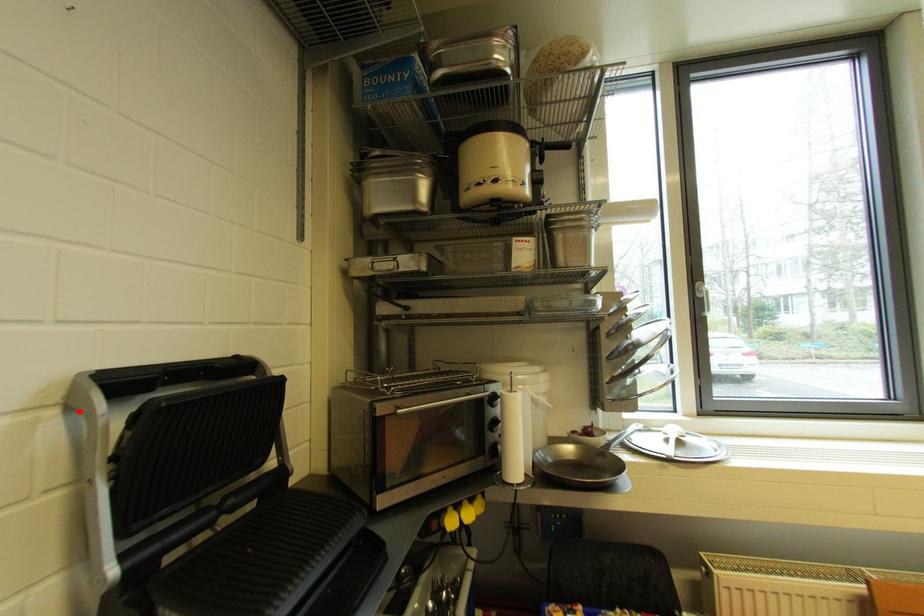
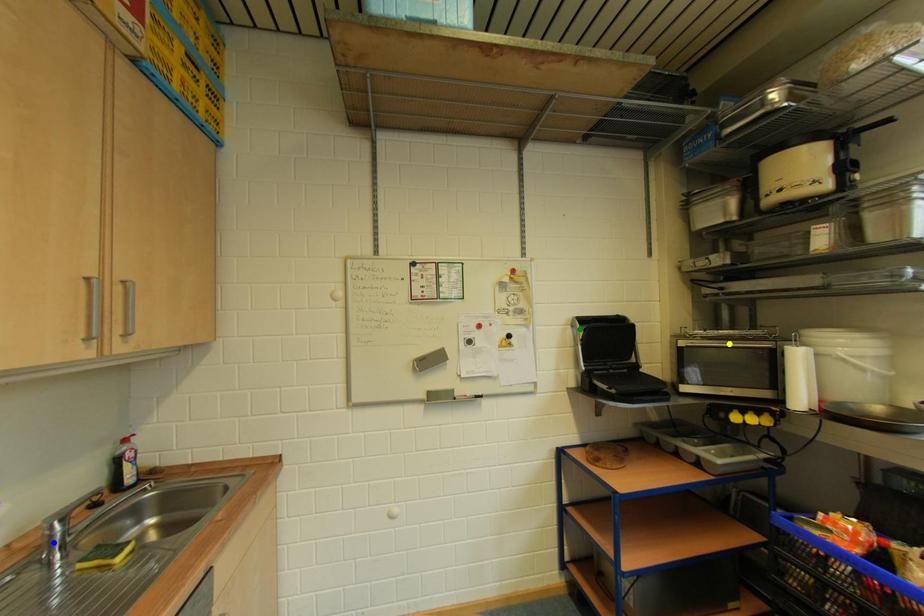
Question: I am providing you with two images of the same scene from different viewpoints. A red point is marked on the first image. You are given multiple points on the second image. Which spot in image 2 lines up with the point in image 1?

Choices:
 (A) green point
 (B) yellow point
 (C) blue point

Answer: (A)